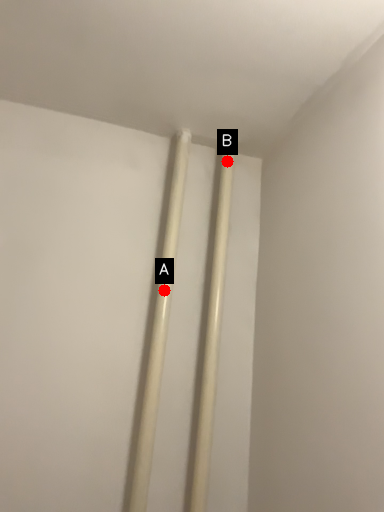
Question: Two points are circled on the image, labeled by A and B beside each circle. Which point is further to the camera?

Choices:
 (A) A is further
 (B) B is further

Answer: (B)